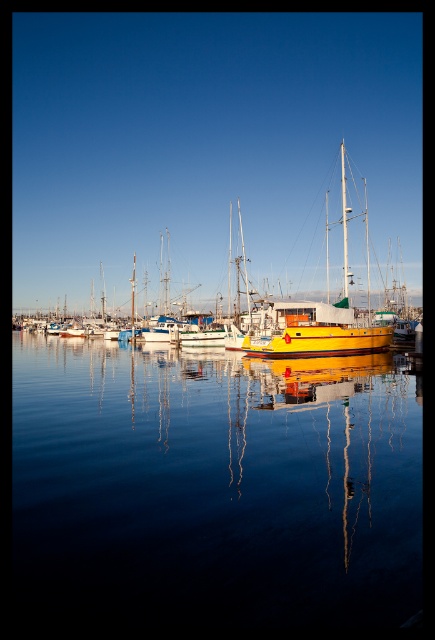
The image size is (435, 640). What do you see at coordinates (211, 488) in the screenshot? I see `glossy water at center` at bounding box center [211, 488].

Where is `glossy water at center`? Image resolution: width=435 pixels, height=640 pixels. glossy water at center is located at coordinates (211, 488).